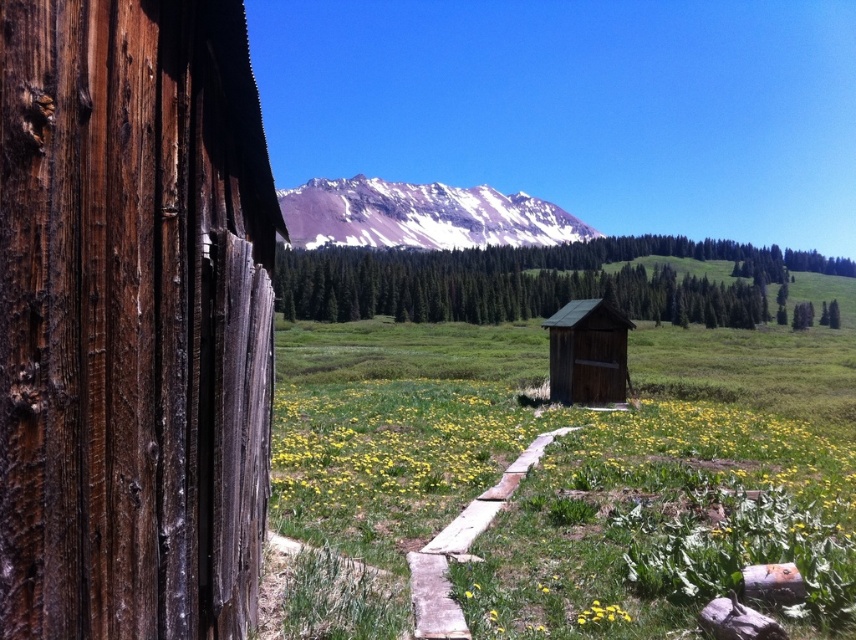
You are standing at the point marked by the coordinates point (132,320) in the image. Looking around, you see the weathered brown wood at left. Which direction should you walk to reach the wooden pathway leading towards the small, dark structure?

The point (132,320) corresponds to the weathered brown wood at left. To reach the wooden pathway leading towards the small, dark structure, you should walk towards the foreground grassy field with yellow flowers, as the pathway starts there and leads towards the structure.

You are standing in front of the rustic wooden structure and want to place two markers at the coordinates point (232, 636) and point (452, 620). Which marker will appear closer to you in the image?

Point (232, 636) is closer to the camera than point (452, 620), so the marker at point (232, 636) will appear closer to you in the image.

You are standing at the entrance of the green wood log cabin at center and want to see the weathered brown wood at left. Which direction should you face to view it?

To see the weathered brown wood at left from the green wood log cabin at center, you should face the left direction since the weathered brown wood at left is positioned to the left of the cabin.